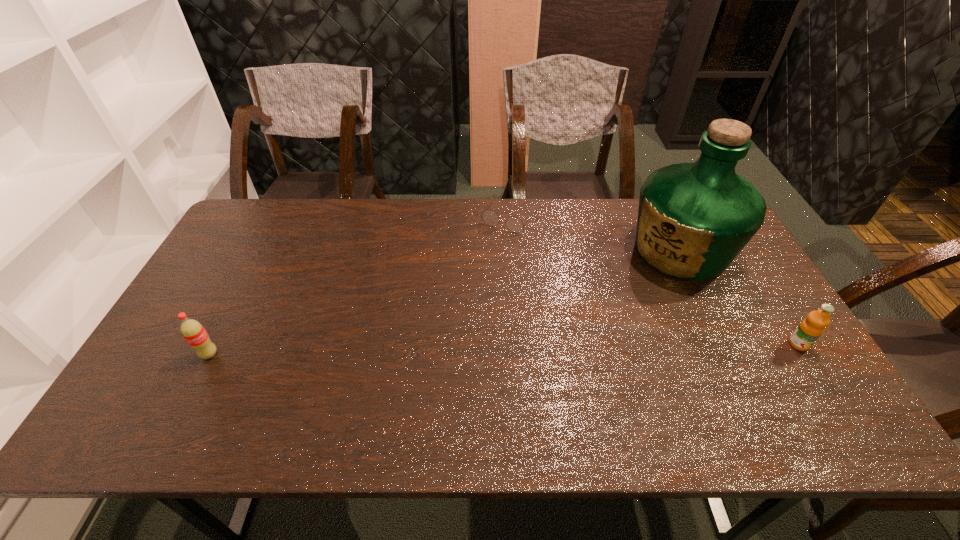
Image resolution: width=960 pixels, height=540 pixels. I want to click on soda, so click(193, 332).

At what (x,y) coordinates should I click in order to perform the action: click on orange juice. Please return your answer as a coordinate pair (x, y). Looking at the image, I should click on (810, 329).

Where is `the third object from right to left`? the third object from right to left is located at coordinates point(514,224).

Locate an element on the screen. spectacles is located at coordinates (514, 224).

This screenshot has height=540, width=960. Find the location of `the tallest object`. the tallest object is located at coordinates (693, 220).

I want to click on free space located 0.240m on the back of the soda, so click(248, 281).

The image size is (960, 540). Find the location of `free space located 0.100m on the label of the orange juice`. free space located 0.100m on the label of the orange juice is located at coordinates (825, 386).

I want to click on free space located on the temples of the third object from right to left, so [468, 282].

The height and width of the screenshot is (540, 960). I want to click on free spot located on the temples of the third object from right to left, so click(468, 282).

What are the coordinates of `vacant space positioned on the temples of the third object from right to left` in the screenshot? It's located at (449, 310).